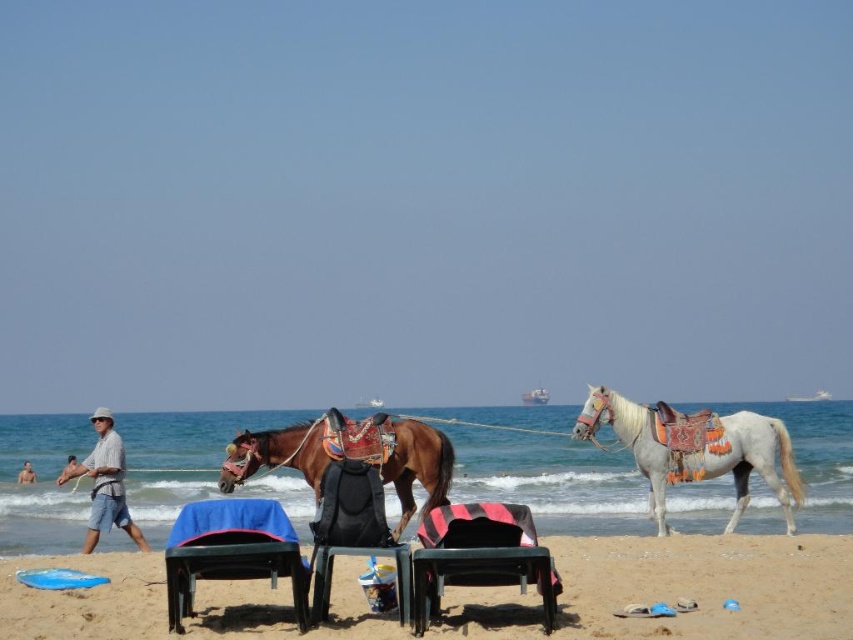
Who is shorter, sandy beach at lower center or blue fabric-covered chair at center?

blue fabric-covered chair at center

Can you confirm if sandy beach at lower center is taller than blue fabric-covered chair at center?

Indeed, sandy beach at lower center has a greater height compared to blue fabric-covered chair at center.

Is point (750, 609) in front of point (189, 520)?

No, (750, 609) is behind (189, 520).

Find the location of a particular element. Image resolution: width=853 pixels, height=640 pixels. sandy beach at lower center is located at coordinates (479, 595).

Does blue fabric-covered chair at center have a larger size compared to light blue denim shorts at lower left?

No, blue fabric-covered chair at center is not bigger than light blue denim shorts at lower left.

Consider the image. Is blue fabric-covered chair at center below light blue denim shorts at lower left?

Incorrect, blue fabric-covered chair at center is not positioned below light blue denim shorts at lower left.

This screenshot has height=640, width=853. Describe the element at coordinates (231, 552) in the screenshot. I see `blue fabric-covered chair at center` at that location.

Where is `blue fabric-covered chair at center`? Image resolution: width=853 pixels, height=640 pixels. blue fabric-covered chair at center is located at coordinates (231, 552).

Consider the image. Which is more to the left, white glossy horse at right or black plastic beach chair at center?

Positioned to the left is black plastic beach chair at center.

Where is `white glossy horse at right`? Image resolution: width=853 pixels, height=640 pixels. white glossy horse at right is located at coordinates (695, 449).